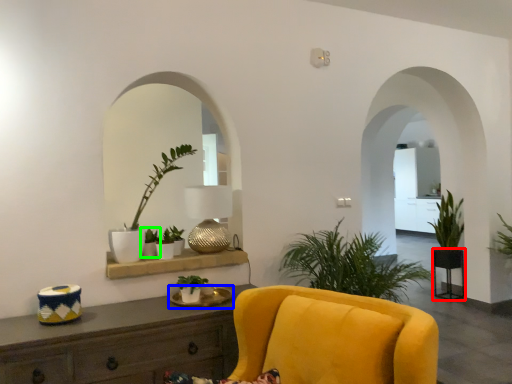
Question: Which object is the farthest from round table (highlighted by a red box)? Choose among these: round table (highlighted by a blue box) or houseplant (highlighted by a green box).

Choices:
 (A) round table
 (B) houseplant

Answer: (B)